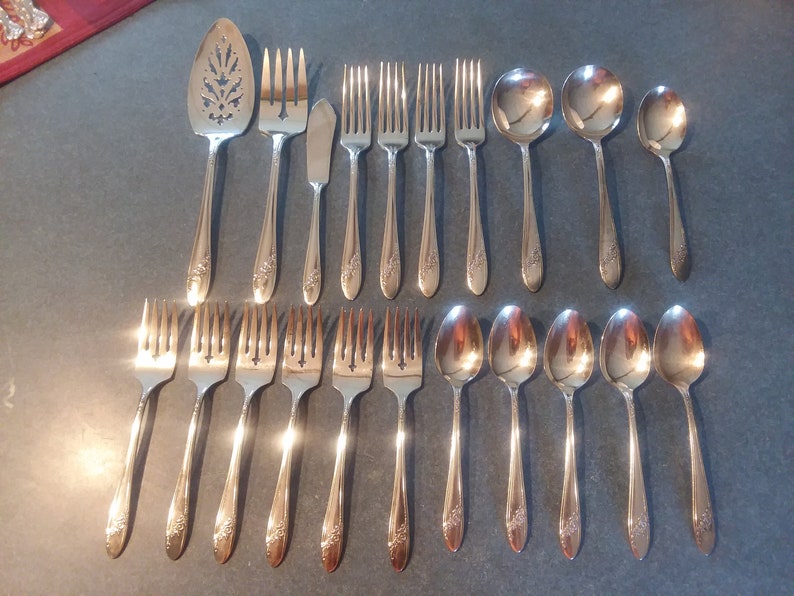
Locate an element on the screen. Image resolution: width=794 pixels, height=596 pixels. spoons is located at coordinates (453, 343), (503, 362), (576, 355), (619, 361), (673, 352), (669, 125), (600, 104), (525, 110), (212, 103).